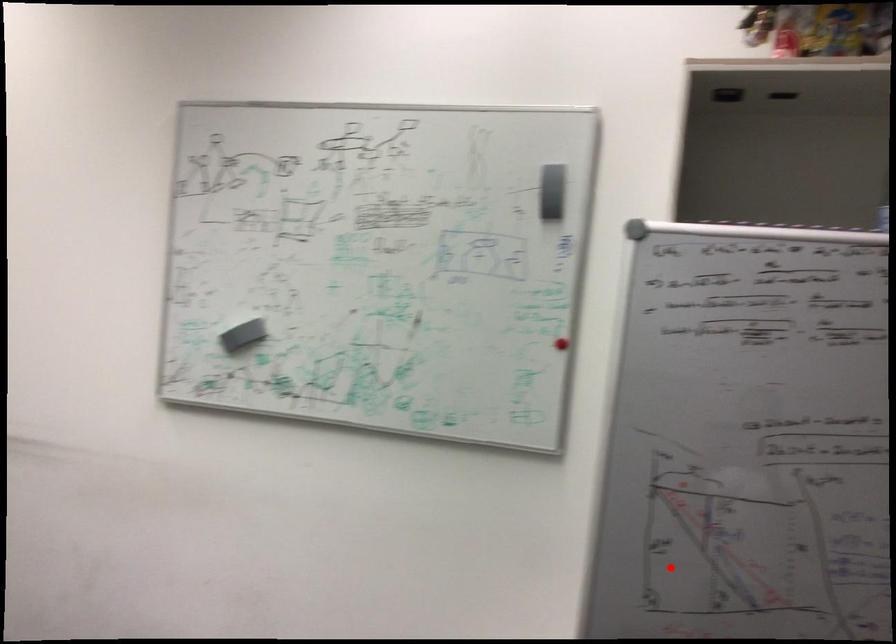
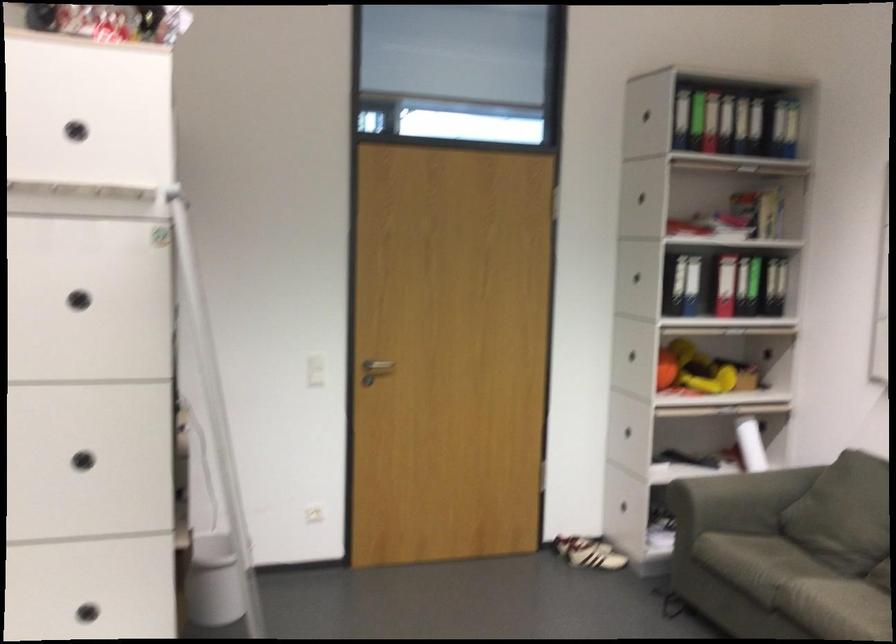
Question: A red point is marked in image1. In image2, is the corresponding 3D point closer to the camera or farther? Reply with the corresponding letter.

Choices:
 (A) The corresponding 3D point is closer.
 (B) The corresponding 3D point is farther.

Answer: (B)